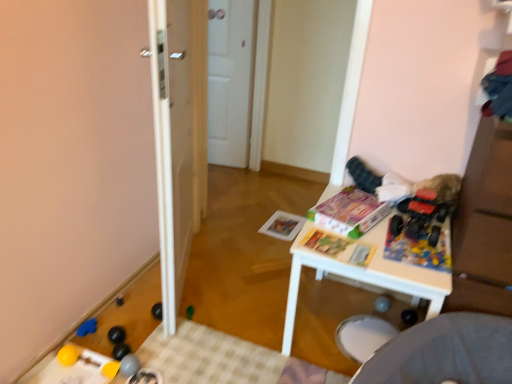
The height and width of the screenshot is (384, 512). In order to click on free space behind rubberized gray ball at lower left, the 5th toy from the top in this screenshot , I will do `click(145, 339)`.